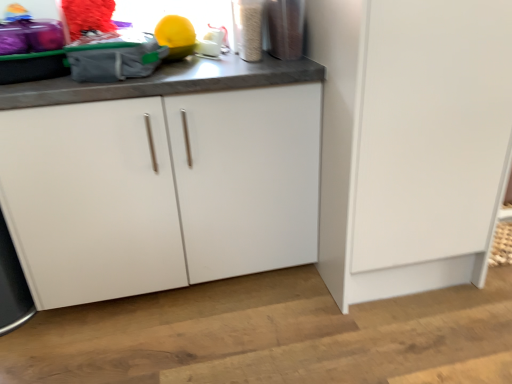
Find the location of `vacant space situated on the left part of metallic silver canister at upper right, the 1th appliance in the left-to-right sequence`. vacant space situated on the left part of metallic silver canister at upper right, the 1th appliance in the left-to-right sequence is located at coordinates (212, 59).